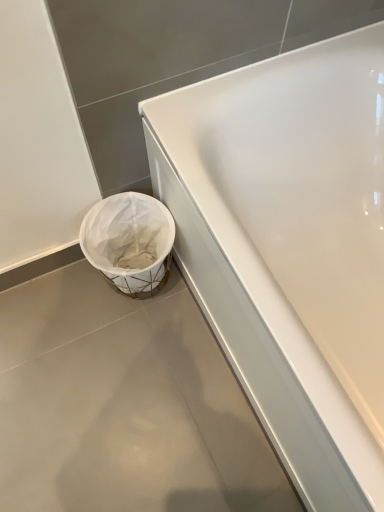
Question: Is white glossy bathtub at center further to the viewer compared to white matte trash can at lower left?

Choices:
 (A) yes
 (B) no

Answer: (B)

Question: Is white glossy bathtub at center smaller than white matte trash can at lower left?

Choices:
 (A) no
 (B) yes

Answer: (A)

Question: Is white glossy bathtub at center not inside white matte trash can at lower left?

Choices:
 (A) yes
 (B) no

Answer: (A)

Question: Is white matte trash can at lower left surrounded by white glossy bathtub at center?

Choices:
 (A) yes
 (B) no

Answer: (B)

Question: From the image's perspective, is white glossy bathtub at center below white matte trash can at lower left?

Choices:
 (A) yes
 (B) no

Answer: (B)

Question: Is white glossy bathtub at center facing towards white matte trash can at lower left?

Choices:
 (A) no
 (B) yes

Answer: (B)

Question: From the image's perspective, is white fabric basket at lower left located above white glossy bathtub at center?

Choices:
 (A) no
 (B) yes

Answer: (B)

Question: Is white fabric basket at lower left to the left of white glossy bathtub at center from the viewer's perspective?

Choices:
 (A) no
 (B) yes

Answer: (B)

Question: From a real-world perspective, does white fabric basket at lower left sit lower than white glossy bathtub at center?

Choices:
 (A) no
 (B) yes

Answer: (B)

Question: Considering the relative sizes of white fabric basket at lower left and white glossy bathtub at center in the image provided, is white fabric basket at lower left wider than white glossy bathtub at center?

Choices:
 (A) no
 (B) yes

Answer: (A)

Question: Does white fabric basket at lower left have a smaller size compared to white glossy bathtub at center?

Choices:
 (A) yes
 (B) no

Answer: (A)

Question: Is white fabric basket at lower left taller than white glossy bathtub at center?

Choices:
 (A) no
 (B) yes

Answer: (A)

Question: Are white matte trash can at lower left and white fabric basket at lower left located far from each other?

Choices:
 (A) no
 (B) yes

Answer: (A)